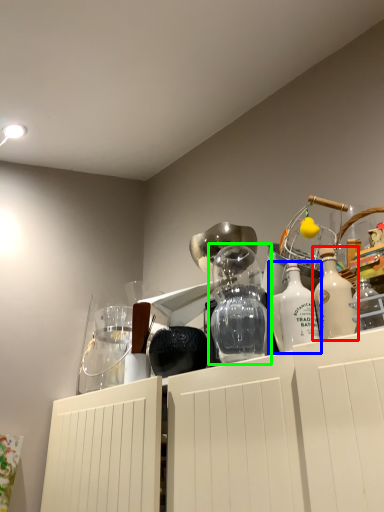
Question: Based on their relative distances, which object is nearer to bottle (highlighted by a red box)? Choose from bottle (highlighted by a blue box) and glass vase (highlighted by a green box).

Choices:
 (A) bottle
 (B) glass vase

Answer: (A)